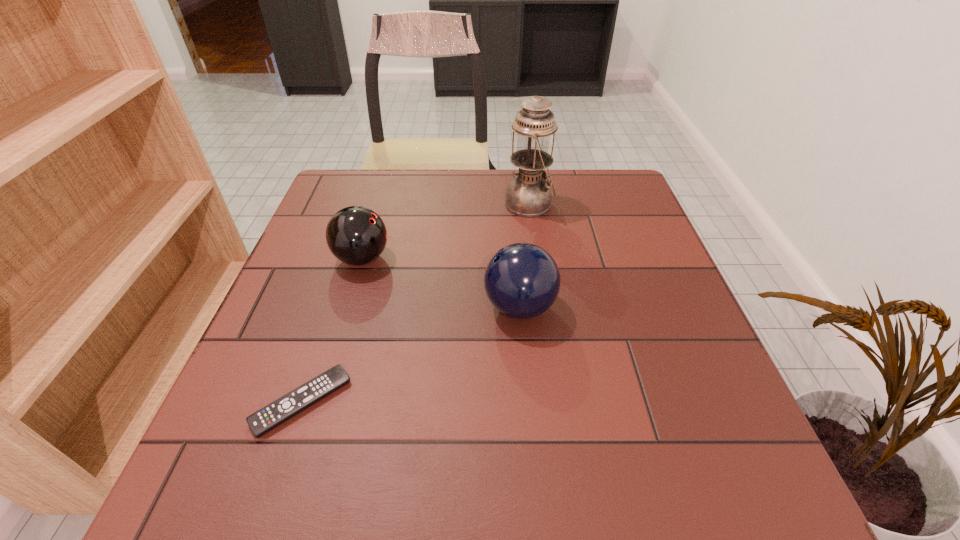
Locate an element on the screen. This screenshot has height=540, width=960. vacant space that is in between the right bowling ball and the farther bowling ball is located at coordinates click(441, 283).

Select which object is the closest to the oil lamp. Please provide its 2D coordinates. Your answer should be formatted as a tuple, i.e. [(x, y)], where the tuple contains the x and y coordinates of a point satisfying the conditions above.

[(522, 280)]

Find the location of `object that ranks as the second closest to the farthest object`. object that ranks as the second closest to the farthest object is located at coordinates (356, 235).

Identify the location of free spot that satisfies the following two spatial constraints: 1. on the surface of the second nearest object near the finger holes; 2. on the front side of the shortest object. This screenshot has height=540, width=960. (528, 402).

The width and height of the screenshot is (960, 540). Find the location of `vacant area that satisfies the following two spatial constraints: 1. on the surface of the third nearest object near the finger holes; 2. on the front side of the remote control`. vacant area that satisfies the following two spatial constraints: 1. on the surface of the third nearest object near the finger holes; 2. on the front side of the remote control is located at coordinates [x=319, y=402].